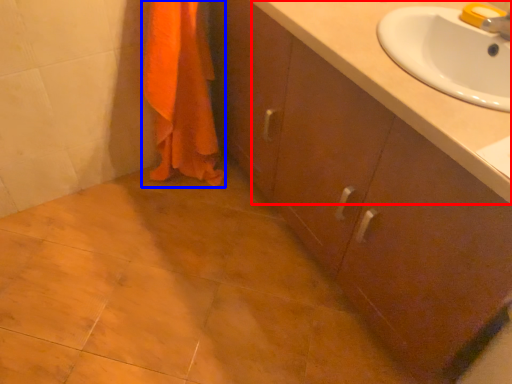
Question: Which object appears farthest to the camera in this image, counter top (highlighted by a red box) or bath towel (highlighted by a blue box)?

Choices:
 (A) counter top
 (B) bath towel

Answer: (B)